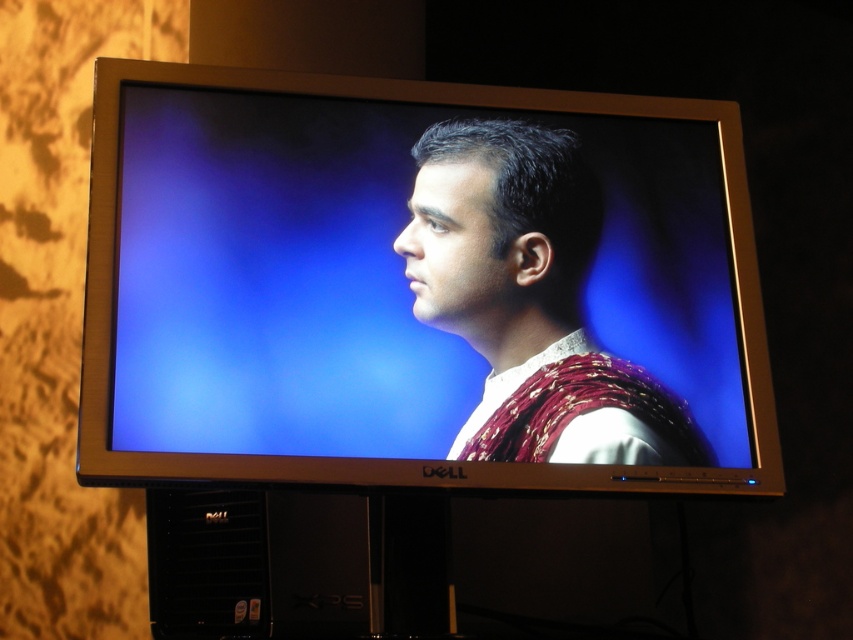
Question: Which of the following is the farthest from the observer?

Choices:
 (A) (312, 253)
 (B) (604, 378)

Answer: (B)

Question: Is satin silver monitor at center positioned behind matte purple fabric at center?

Choices:
 (A) yes
 (B) no

Answer: (B)

Question: Is satin silver monitor at center above matte purple fabric at center?

Choices:
 (A) no
 (B) yes

Answer: (B)

Question: Can you confirm if satin silver monitor at center is positioned to the right of matte purple fabric at center?

Choices:
 (A) no
 (B) yes

Answer: (A)

Question: Which point is farther from the camera taking this photo?

Choices:
 (A) (445, 128)
 (B) (161, 204)

Answer: (A)